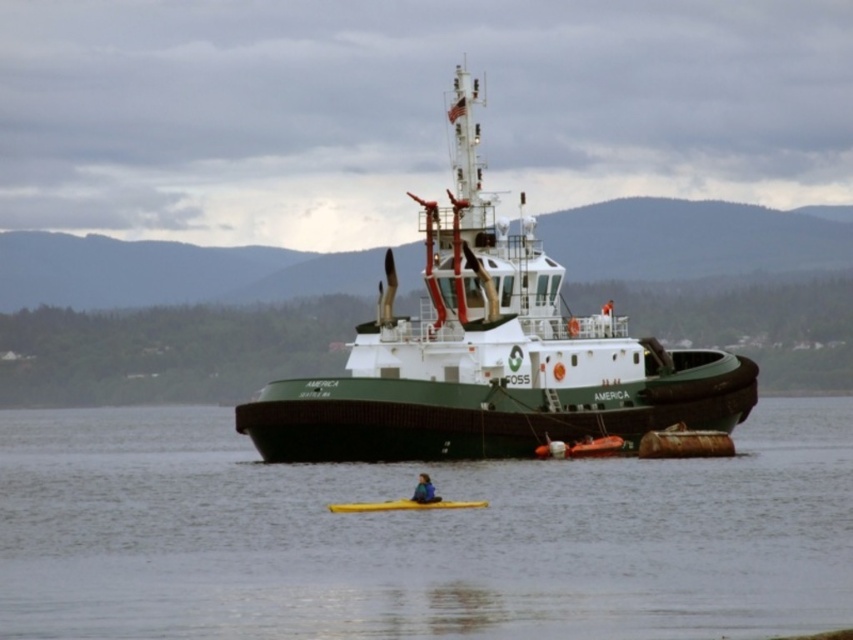
Question: Observing the image, what is the correct spatial positioning of green matte water at center in reference to green matte tugboat at center?

Choices:
 (A) right
 (B) left

Answer: (B)

Question: Which of the following is the closest to the observer?

Choices:
 (A) (759, 596)
 (B) (416, 490)

Answer: (A)

Question: Which point is closer to the camera?

Choices:
 (A) (415, 506)
 (B) (822, 497)

Answer: (A)

Question: Does green matte water at center appear on the left side of blue fabric kayak at lower center?

Choices:
 (A) no
 (B) yes

Answer: (A)

Question: Does green matte water at center appear on the right side of yellow matte canoe at lower center?

Choices:
 (A) yes
 (B) no

Answer: (A)

Question: Considering the real-world distances, which object is farthest from the yellow matte canoe at lower center?

Choices:
 (A) green matte water at center
 (B) green matte tugboat at center
 (C) blue fabric kayak at lower center

Answer: (A)